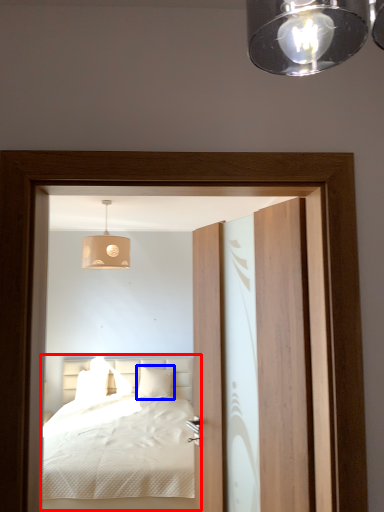
Question: Among these objects, which one is farthest to the camera, bed (highlighted by a red box) or pillow (highlighted by a blue box)?

Choices:
 (A) bed
 (B) pillow

Answer: (B)